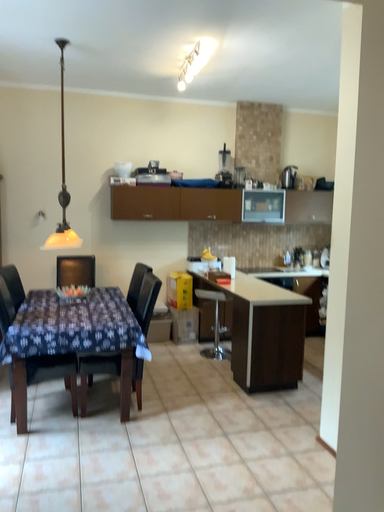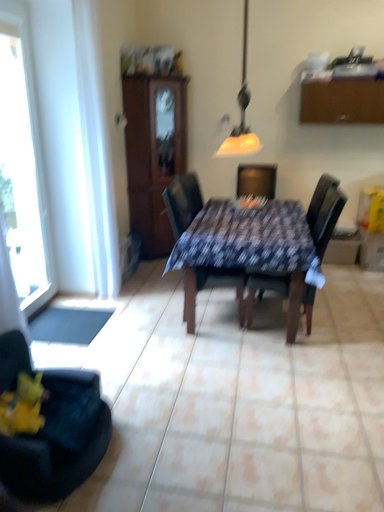
Question: Which way did the camera rotate in the video?

Choices:
 (A) rotated left
 (B) rotated right

Answer: (A)